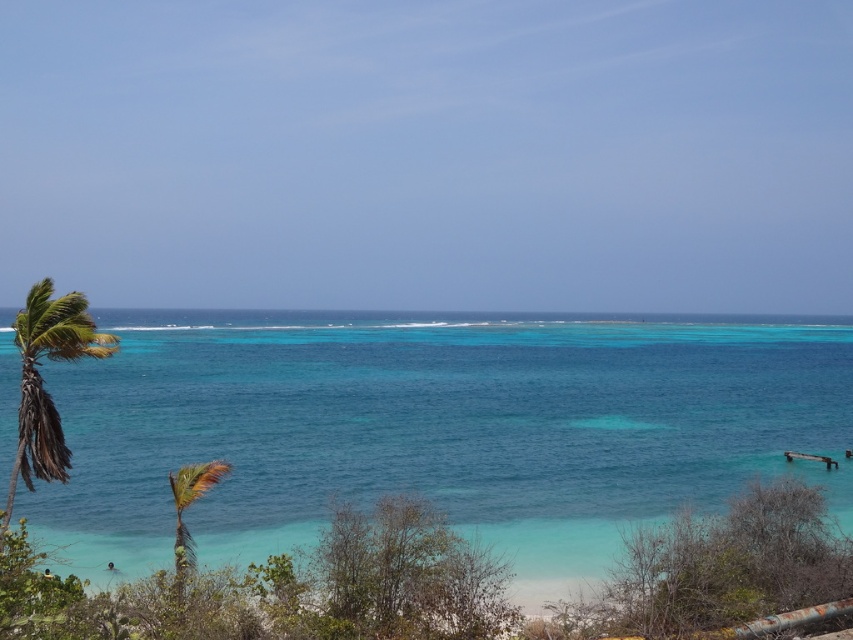
You are a landscape architect planning to install a new walkway between the green leafy shrubs at lower center and the green leafy palm tree at lower left. Considering their widths, which one will require more space to accommodate on the walkway?

The green leafy shrubs at lower center require more space because their width surpasses that of the green leafy palm tree at lower left.

You are standing on the beach and want to walk towards the clear blue water at center. Which direction should you head relative to the green leafy palm tree at left?

Since the clear blue water at center is to the left of the green leafy palm tree at left, you should head towards the left side of the green leafy palm tree at left to reach the water.

You are standing on the beach and want to take a photo of the point at coordinates (28, 410). Is this point within your camera frame?

The point at coordinates (28, 410) is 21.43 meters away from the camera, so it is within the camera frame.